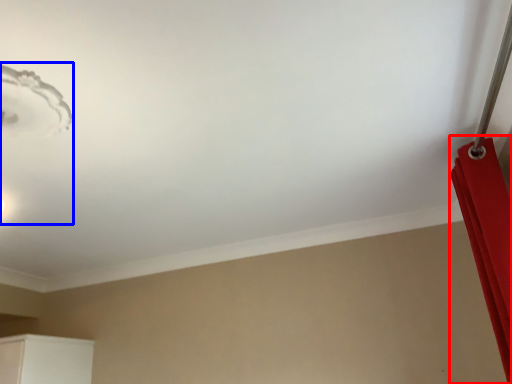
Question: Which object appears farthest to the camera in this image, curtain (highlighted by a red box) or lamp (highlighted by a blue box)?

Choices:
 (A) curtain
 (B) lamp

Answer: (A)